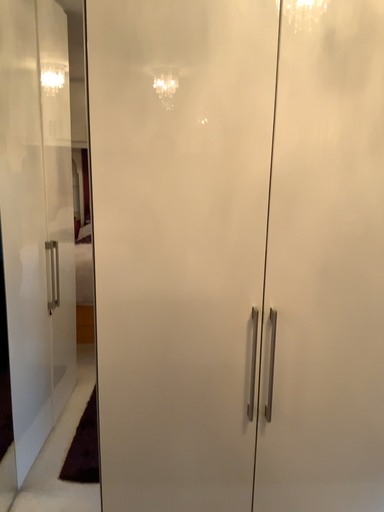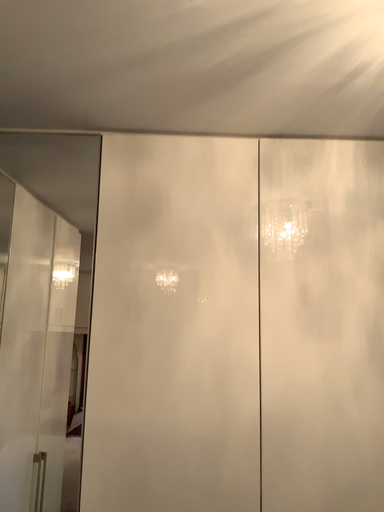
Question: How did the camera likely rotate when shooting the video?

Choices:
 (A) rotated downward
 (B) rotated upward

Answer: (B)